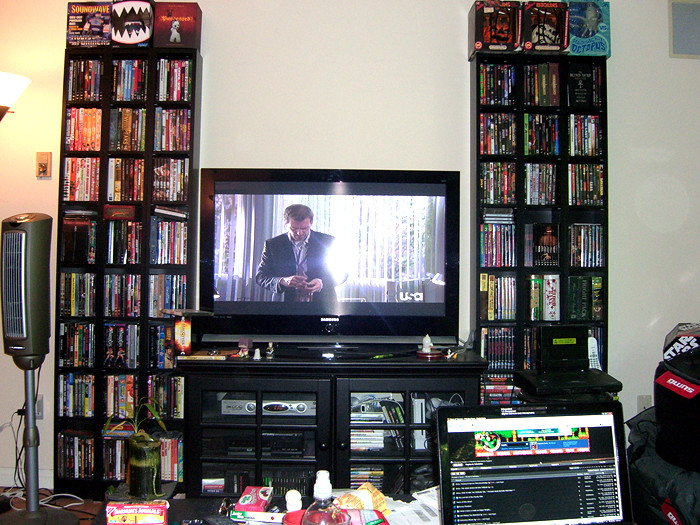
At what (x,y) coordinates should I click in order to perform the action: click on cabinet. Please return your answer as a coordinate pair (x, y). This screenshot has width=700, height=525. Looking at the image, I should click on (357, 382).